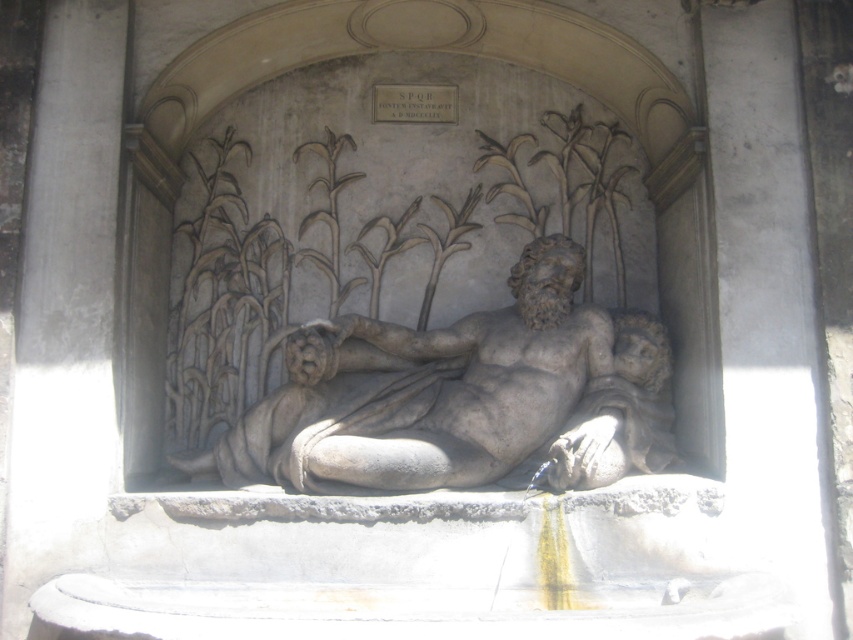
Question: Which point is farther from the camera taking this photo?

Choices:
 (A) (645, 419)
 (B) (525, 284)

Answer: (B)

Question: Is the position of gray stone reclining man at center more distant than that of gray stone reclining figure at center?

Choices:
 (A) no
 (B) yes

Answer: (A)

Question: In this image, where is gray stone reclining man at center located relative to gray stone reclining figure at center?

Choices:
 (A) left
 (B) right

Answer: (A)

Question: Which point is farther to the camera?

Choices:
 (A) (345, 412)
 (B) (602, 426)

Answer: (A)

Question: Can you confirm if gray stone reclining man at center is smaller than gray stone reclining figure at center?

Choices:
 (A) no
 (B) yes

Answer: (A)

Question: Which object appears farthest from the camera in this image?

Choices:
 (A) gray stone reclining figure at center
 (B) gray stone reclining man at center

Answer: (A)